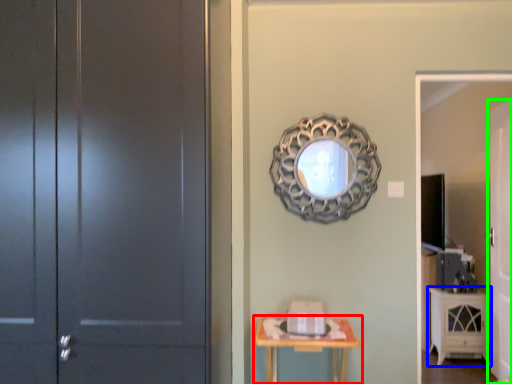
Question: Which object is positioned closest to table (highlighted by a red box)? Select from cabinetry (highlighted by a blue box) and door (highlighted by a green box).

Choices:
 (A) cabinetry
 (B) door

Answer: (B)